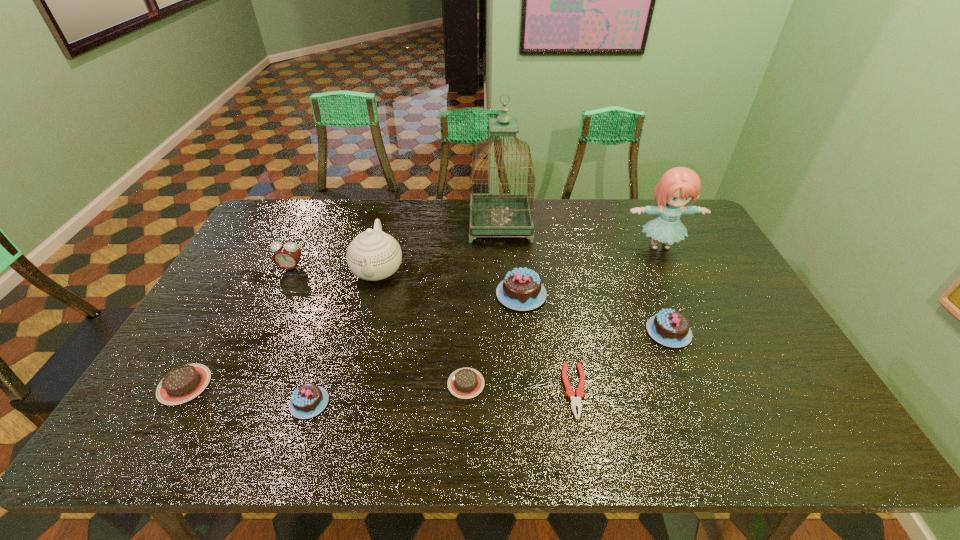
Identify the location of free spot at the near edge of the desktop. (435, 433).

The height and width of the screenshot is (540, 960). Find the location of `free location at the left edge`. free location at the left edge is located at coordinates (225, 359).

Find the location of a particular element. The height and width of the screenshot is (540, 960). free point between the second shortest object and the rightmost chocolate cake is located at coordinates pyautogui.click(x=567, y=357).

Locate an element on the screen. vacant area that lies between the bigger brown chocolate cake and the leftmost pink chocolate cake is located at coordinates (247, 394).

Locate an element on the screen. This screenshot has width=960, height=540. free space between the chinaware and the fourth shortest object is located at coordinates pyautogui.click(x=344, y=336).

Image resolution: width=960 pixels, height=540 pixels. I want to click on empty space that is in between the nearest pink chocolate cake and the biggest pink chocolate cake, so click(x=416, y=349).

Image resolution: width=960 pixels, height=540 pixels. What are the coordinates of `free space that is in between the leftmost object and the third tallest chocolate cake` in the screenshot? It's located at (247, 394).

Where is `free space that is in between the chinaware and the third shortest chocolate cake`? The height and width of the screenshot is (540, 960). free space that is in between the chinaware and the third shortest chocolate cake is located at coordinates (344, 336).

This screenshot has height=540, width=960. I want to click on empty space between the shortest object and the tallest object, so click(x=538, y=308).

In order to click on vacant space that is in between the doll and the eighth shortest object in this screenshot , I will do `click(518, 258)`.